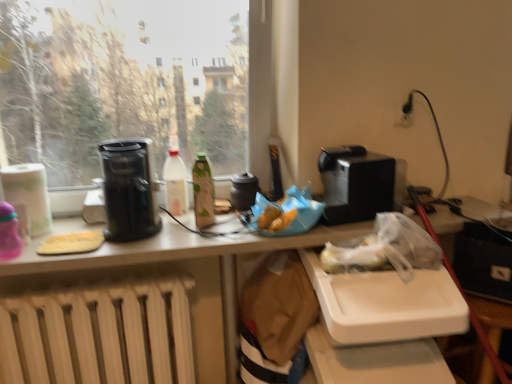
Question: Would you say black plastic toaster at upper right, which appears as the second appliance when viewed from the left, is inside or outside black plastic coffee maker at left?

Choices:
 (A) inside
 (B) outside

Answer: (B)

Question: Considering the positions of black plastic toaster at upper right, the 1th appliance from the right, and black plastic coffee maker at left in the image, is black plastic toaster at upper right, the 1th appliance from the right, bigger or smaller than black plastic coffee maker at left?

Choices:
 (A) big
 (B) small

Answer: (B)

Question: Considering the real-world distances, which object is closest to the white matte bottle at center, arranged as the 2th bottle when viewed from the right?

Choices:
 (A) transparent glass window at upper left
 (B) black plastic coffee maker at left
 (C) black plastic toaster at upper right, which appears as the second appliance when viewed from the left
 (D) yellow sponge at left
 (E) matte black kettle at center, the 2th appliance positioned from the right

Answer: (B)

Question: Estimate the real-world distances between objects in this image. Which object is closer to the green matte bottle at center, marked as the 1th bottle in a right-to-left arrangement?

Choices:
 (A) white matte radiator at lower left
 (B) black plastic coffee maker at left
 (C) matte black kettle at center, the 2th appliance positioned from the right
 (D) white matte bottle at center, arranged as the 2th bottle when viewed from the right
 (E) transparent glass window at upper left

Answer: (D)